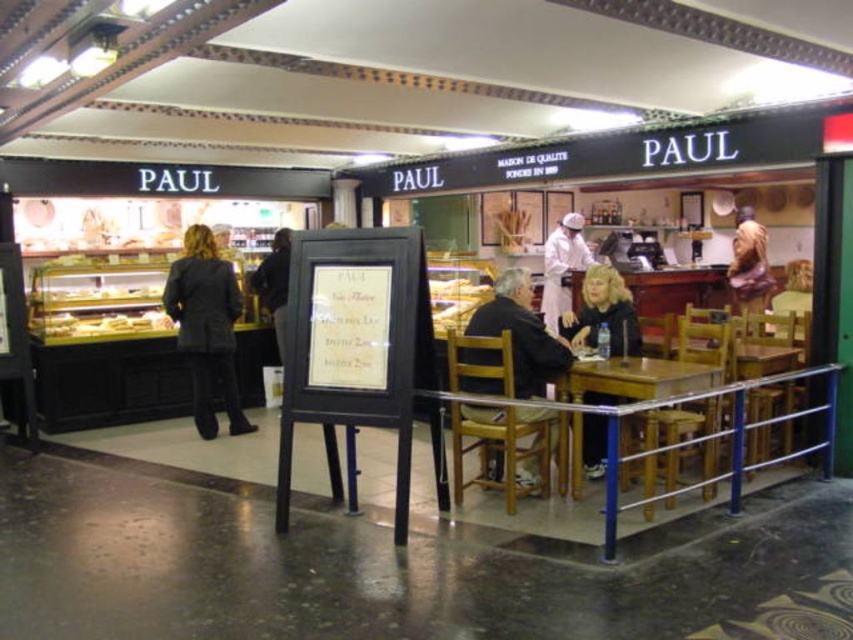
You are a customer sitting at the table in the Paul bakery. You notice two features at the center of the table area. Which one is closer to you, the blonde hair at table center or the smooth beige shirt at center?

The blonde hair at table center is in front of the smooth beige shirt at center, so the blonde hair at table center is closer to you.

You are a customer standing at the entrance of the Paul bakery. You see two people sitting at a table in the center of the room. One is wearing a white uniform at center and the other is wearing a smooth beige shirt at center. You want to approach them to ask a question. If you start walking from the entrance, which person will you reach first?

The white uniform at center is 2.13 meters away from the smooth beige shirt at center. Since you are starting from the entrance, it depends on their positions relative to your starting point. However, without specific information about their exact locations along the line of sight, we cannot determine who is closer. Please provide more details about their arrangement.

You are a customer at Paul bakery and want to read the text on the whiteboard. You notice the wooden statue at center and the smooth beige shirt at center. Which object is closer to you?

The wooden statue at center is closer to you because the smooth beige shirt at center is behind it.